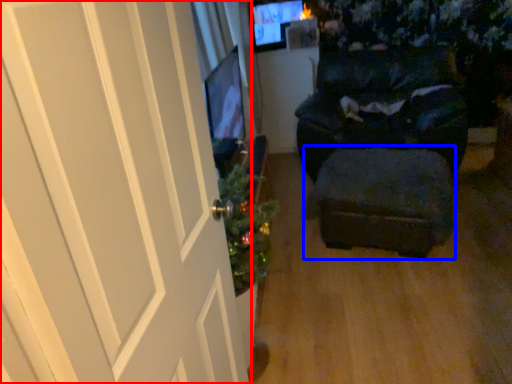
Question: Which object is closer to the camera taking this photo, door (highlighted by a red box) or stool (highlighted by a blue box)?

Choices:
 (A) door
 (B) stool

Answer: (A)